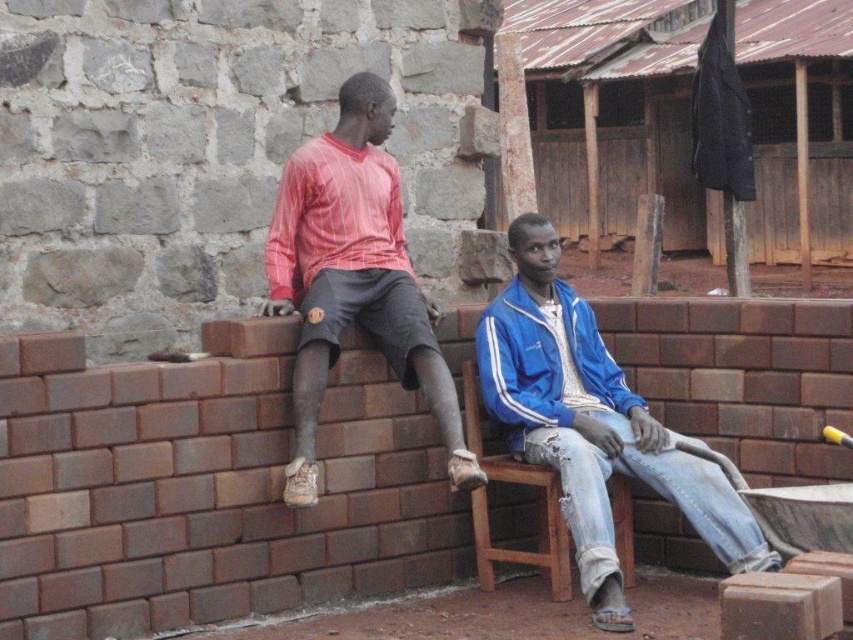
Can you confirm if blue fabric jacket at center is bigger than matte red shirt at left?

Yes.

How far apart are blue fabric jacket at center and matte red shirt at left?

blue fabric jacket at center is 1.09 meters from matte red shirt at left.

This screenshot has height=640, width=853. I want to click on blue fabric jacket at center, so click(x=593, y=424).

Consider the image. Which of these two, rusty metal hut at center or wooden at right, stands shorter?

rusty metal hut at center is shorter.

Is point (762, 237) behind point (515, 557)?

Yes, point (762, 237) is behind point (515, 557).

Between point (810, 264) and point (476, 392), which one is positioned in front?

Point (476, 392) is more forward.

You are a GUI agent. You are given a task and a screenshot of the screen. Output one action in this format:
    pyautogui.click(x=<x>, y=<y>)
    Task: Click on the rusty metal hut at center
    
    Given the screenshot: What is the action you would take?
    pyautogui.click(x=614, y=115)

How far apart are rusty metal hut at center and blue fabric jacket at center?

rusty metal hut at center and blue fabric jacket at center are 49.38 feet apart.

Is rusty metal hut at center to the right of blue fabric jacket at center from the viewer's perspective?

Yes, rusty metal hut at center is to the right of blue fabric jacket at center.

Does point (770, 68) lie in front of point (576, 550)?

No, it is not.

Find the location of `rusty metal hut at center`. rusty metal hut at center is located at coordinates (614, 115).